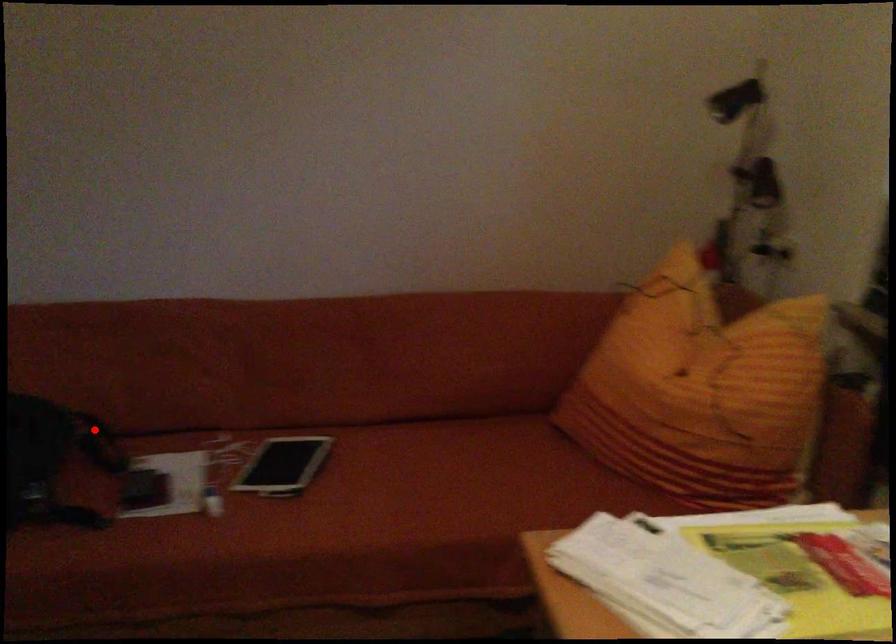
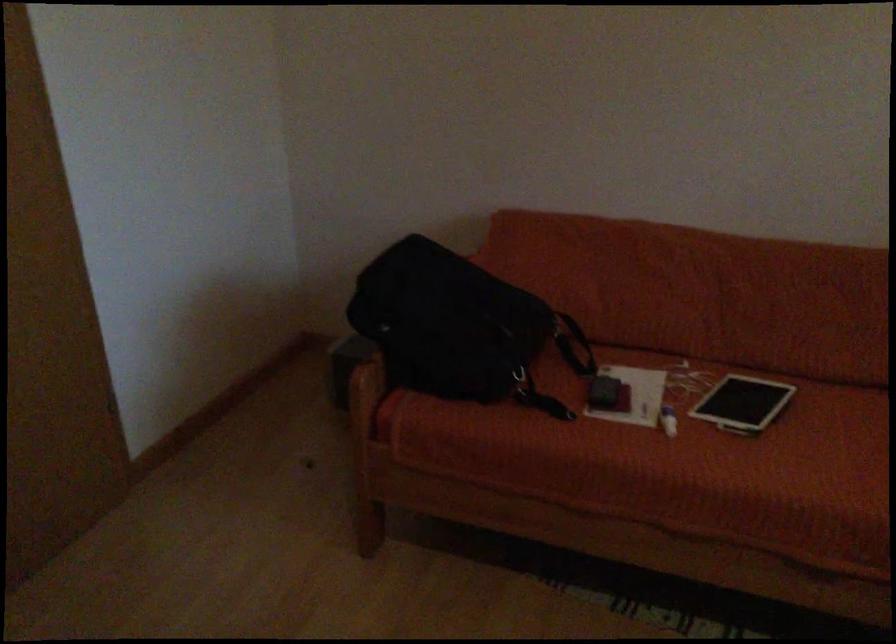
Find the pixel in the second image that matches the highlighted location in the first image.

(567, 332)